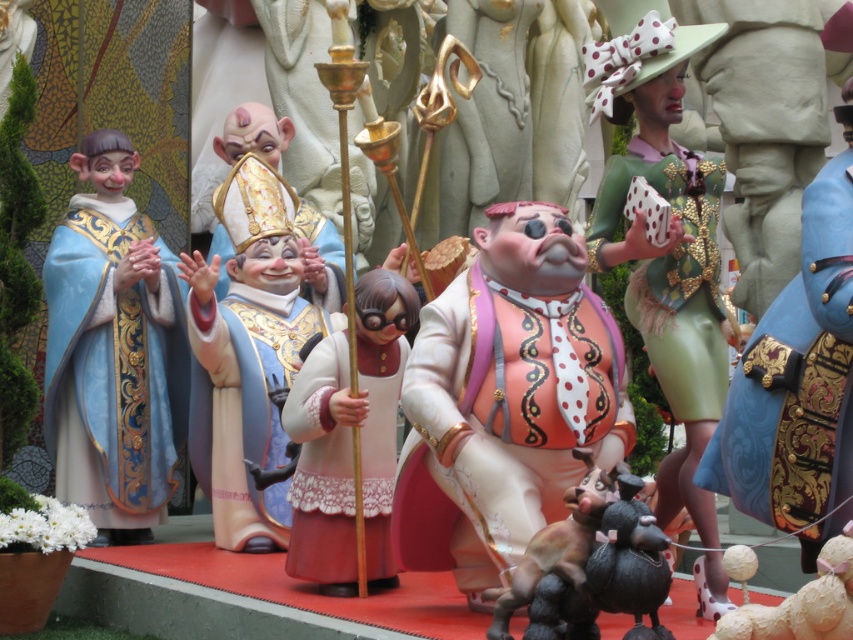
Is matte pink fabric at center positioned before pink glossy doll at center?

Yes, matte pink fabric at center is in front of pink glossy doll at center.

Can you confirm if matte pink fabric at center is positioned to the right of pink glossy doll at center?

Correct, you'll find matte pink fabric at center to the right of pink glossy doll at center.

Describe the element at coordinates (505, 401) in the screenshot. This screenshot has width=853, height=640. I see `matte pink fabric at center` at that location.

Where is `matte pink fabric at center`? This screenshot has width=853, height=640. matte pink fabric at center is located at coordinates (505, 401).

Is matte pink fabric at center further to camera compared to matte blue fabric at left?

No, matte pink fabric at center is in front of matte blue fabric at left.

Does point (491, 490) come in front of point (132, 214)?

Yes.

This screenshot has height=640, width=853. Find the location of `matte pink fabric at center`. matte pink fabric at center is located at coordinates point(505,401).

In the scene shown: Is matte pink fabric at center smaller than white textured dog at lower right?

Actually, matte pink fabric at center might be larger than white textured dog at lower right.

Is point (584, 307) behind point (828, 592)?

Yes, point (584, 307) is behind point (828, 592).

Does point (611, 445) come in front of point (845, 540)?

No.

I want to click on matte pink fabric at center, so click(505, 401).